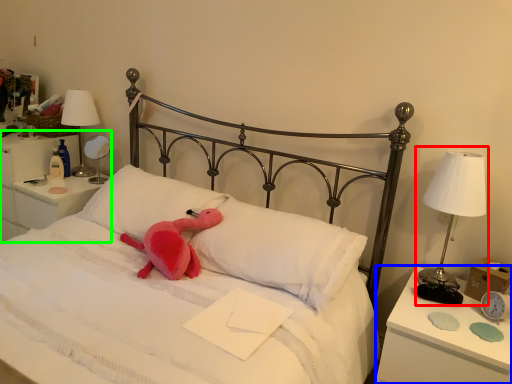
Question: Based on their relative distances, which object is farther from bedside lamp (highlighted by a red box)? Choose from nightstand (highlighted by a blue box) and nightstand (highlighted by a green box).

Choices:
 (A) nightstand
 (B) nightstand

Answer: (B)